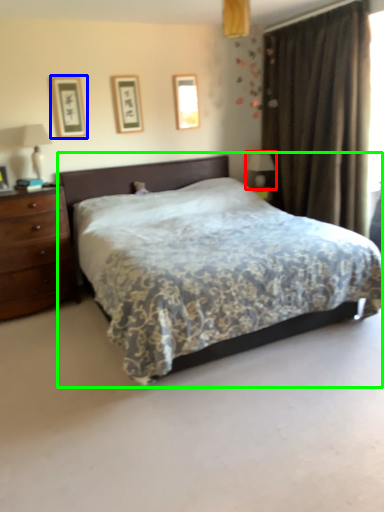
Question: Which object is the closest to the table lamp (highlighted by a red box)? Choose among these: picture frame (highlighted by a blue box) or bed (highlighted by a green box).

Choices:
 (A) picture frame
 (B) bed

Answer: (B)